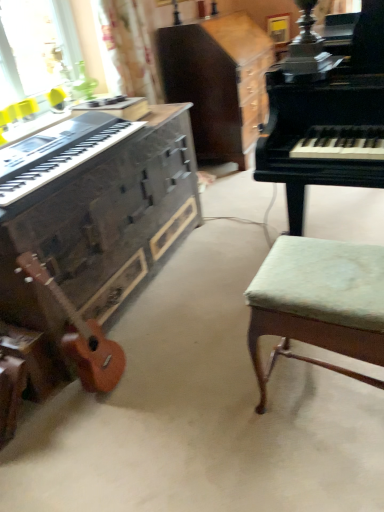
Locate an element on the screen. The height and width of the screenshot is (512, 384). vacant space underneath green fabric stool at right (from a real-world perspective) is located at coordinates (322, 395).